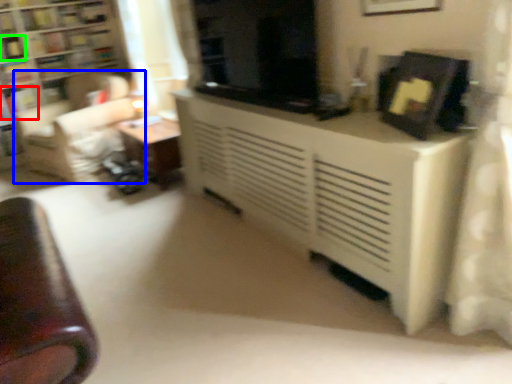
Question: Which object is positioned closest to book (highlighted by a red box)? Select from swivel chair (highlighted by a blue box) and book (highlighted by a green box).

Choices:
 (A) swivel chair
 (B) book

Answer: (B)